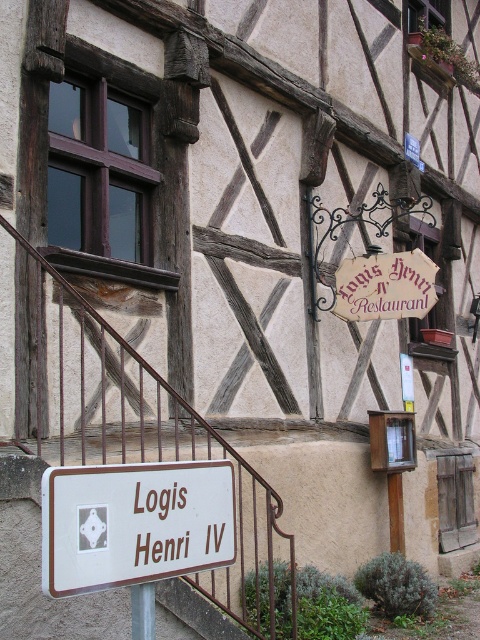
You are standing at the base of the staircase of the traditional half timbered building and see the white matte sign at lower center and the silver metallic pole at lower center. Which object is positioned to the left when facing the building?

The white matte sign at lower center is positioned to the left of the silver metallic pole at lower center when facing the building.

You are a delivery person trying to park your 1.2 meter wide cart in front of the Logis Henri IV entrance. The space between the white matte sign at lower center and the silver metallic pole at lower center is available. Can your cart fit there?

The white matte sign at lower center is wider than the silver metallic pole at lower center. However, the total available space between them isn